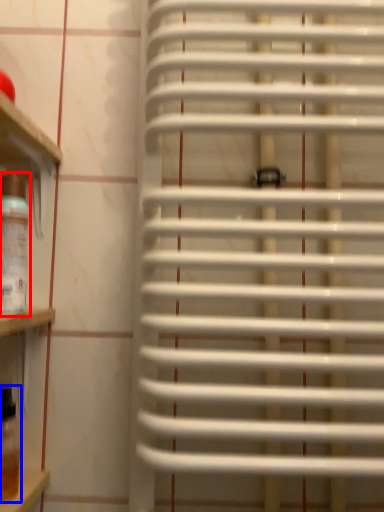
Question: Among these objects, which one is nearest to the camera, wine bottle (highlighted by a red box) or wine bottle (highlighted by a blue box)?

Choices:
 (A) wine bottle
 (B) wine bottle

Answer: (A)